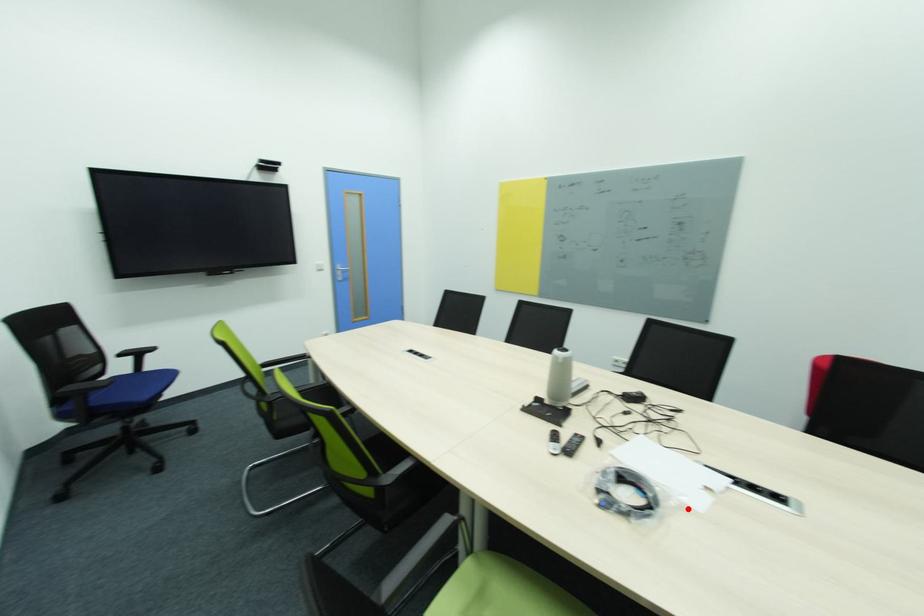
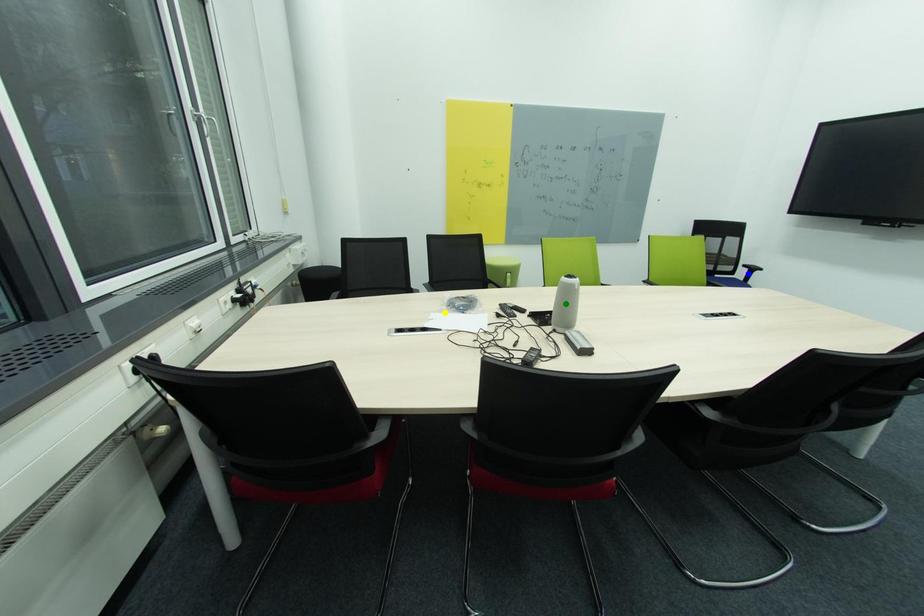
Question: I am providing you with two images of the same scene from different viewpoints. A red point is marked on the first image. You are given multiple points on the second image. Which spot in image 2 lines up with the point in image 1?

Choices:
 (A) blue point
 (B) yellow point
 (C) green point

Answer: (B)